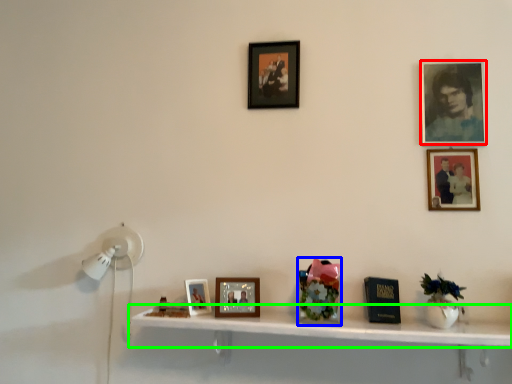
Question: Based on their relative distances, which object is nearer to picture frame (highlighted by a red box)? Choose from art (highlighted by a blue box) and shelf (highlighted by a green box).

Choices:
 (A) art
 (B) shelf

Answer: (A)